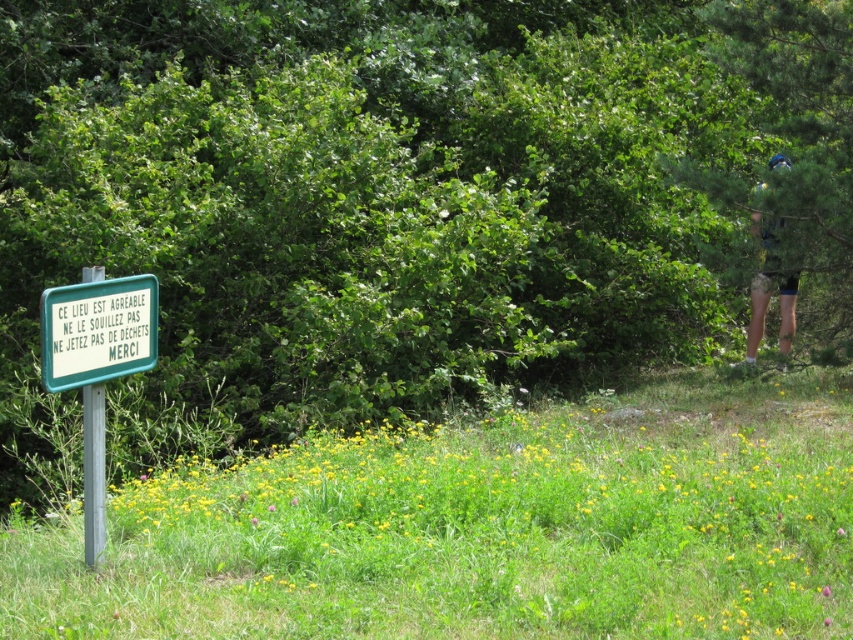
Can you confirm if green grassy at left is positioned above green plastic sign at left?

No, green grassy at left is not above green plastic sign at left.

Measure the distance between green grassy at left and camera.

green grassy at left and camera are 15.65 feet apart from each other.

Identify the location of green grassy at left. Image resolution: width=853 pixels, height=640 pixels. (485, 529).

Is point (50, 320) positioned after point (772, 256)?

No, it is in front of (772, 256).

Who is more distant from viewer, (112,369) or (750,230)?

Positioned behind is point (750,230).

What do you see at coordinates (97, 330) in the screenshot? The height and width of the screenshot is (640, 853). I see `green plastic sign at left` at bounding box center [97, 330].

Where is `green plastic sign at left`? This screenshot has width=853, height=640. green plastic sign at left is located at coordinates (97, 330).

Who is positioned more to the right, green metallic sign at left or camouflage shorts at right?

camouflage shorts at right

Between point (155, 298) and point (770, 157), which one is positioned behind?

The point (770, 157) is more distant.

In order to click on green metallic sign at left in this screenshot , I will do `click(96, 364)`.